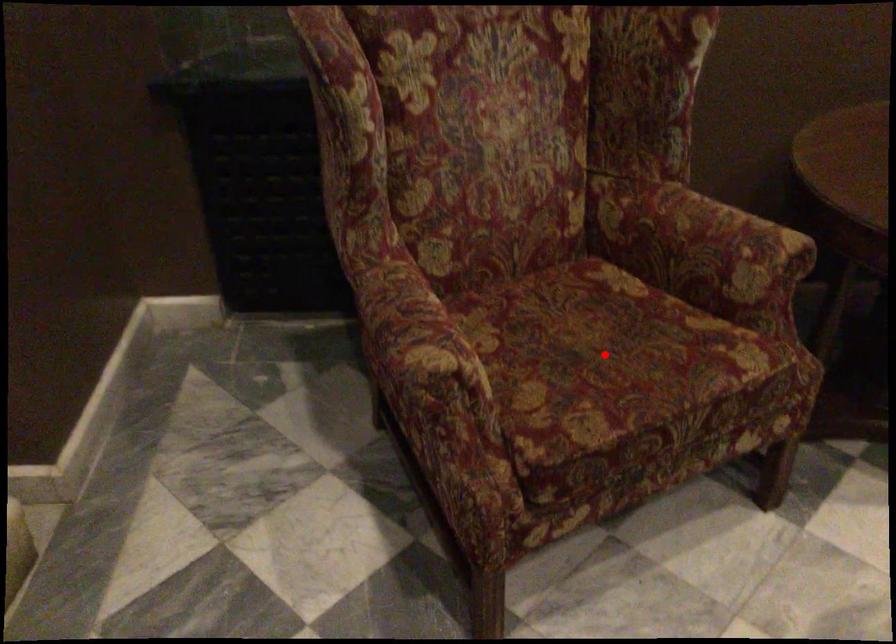
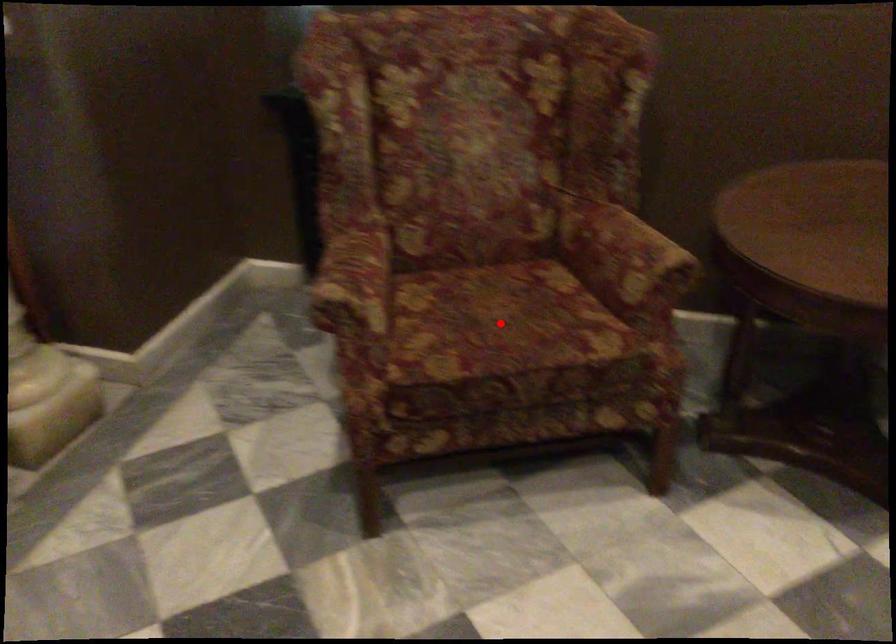
I am providing you with two images of the same scene from different viewpoints. A red point is marked on the first image and another point is marked on the second image. Is the red point in image1 aligned with the point shown in image2?

Yes